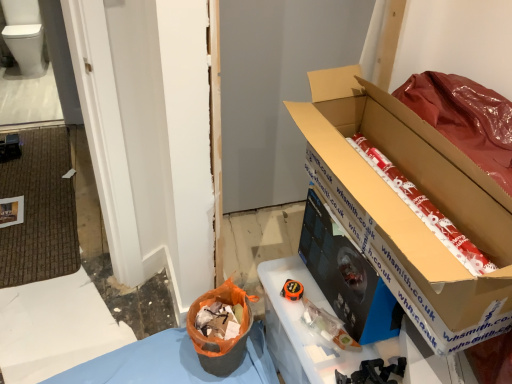
Question: Are cardboard box at right and orange fabric bag at lower center located far from each other?

Choices:
 (A) no
 (B) yes

Answer: (A)

Question: Is the depth of cardboard box at right greater than that of orange fabric bag at lower center?

Choices:
 (A) no
 (B) yes

Answer: (A)

Question: Is cardboard box at right taller than orange fabric bag at lower center?

Choices:
 (A) yes
 (B) no

Answer: (A)

Question: From the image's perspective, is cardboard box at right under orange fabric bag at lower center?

Choices:
 (A) yes
 (B) no

Answer: (B)

Question: Is cardboard box at right wider than orange fabric bag at lower center?

Choices:
 (A) no
 (B) yes

Answer: (B)

Question: From a real-world perspective, is orange fabric bag at lower center positioned above or below white glossy toilet bowl at upper left?

Choices:
 (A) above
 (B) below

Answer: (B)

Question: From their relative heights in the image, would you say orange fabric bag at lower center is taller or shorter than white glossy toilet bowl at upper left?

Choices:
 (A) short
 (B) tall

Answer: (A)

Question: Based on their positions, is orange fabric bag at lower center located to the left or right of white glossy toilet bowl at upper left?

Choices:
 (A) right
 (B) left

Answer: (A)

Question: In the image, is orange fabric bag at lower center positioned in front of or behind white glossy toilet bowl at upper left?

Choices:
 (A) front
 (B) behind

Answer: (A)

Question: Do you think orange fabric bag at lower center is within red wrapping paper at right, or outside of it?

Choices:
 (A) outside
 (B) inside

Answer: (A)

Question: From the image's perspective, is orange fabric bag at lower center located above or below red wrapping paper at right?

Choices:
 (A) above
 (B) below

Answer: (B)

Question: From a real-world perspective, is orange fabric bag at lower center positioned above or below red wrapping paper at right?

Choices:
 (A) below
 (B) above

Answer: (A)

Question: In terms of size, does orange fabric bag at lower center appear bigger or smaller than red wrapping paper at right?

Choices:
 (A) small
 (B) big

Answer: (B)

Question: Is red wrapping paper at right taller or shorter than cardboard box at right?

Choices:
 (A) tall
 (B) short

Answer: (B)

Question: Do you think red wrapping paper at right is within cardboard box at right, or outside of it?

Choices:
 (A) outside
 (B) inside

Answer: (B)